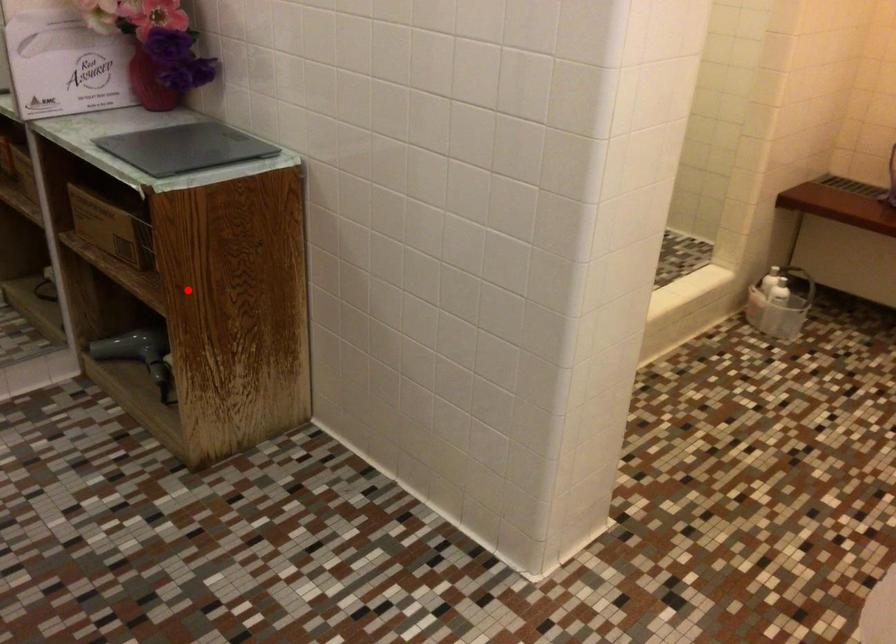
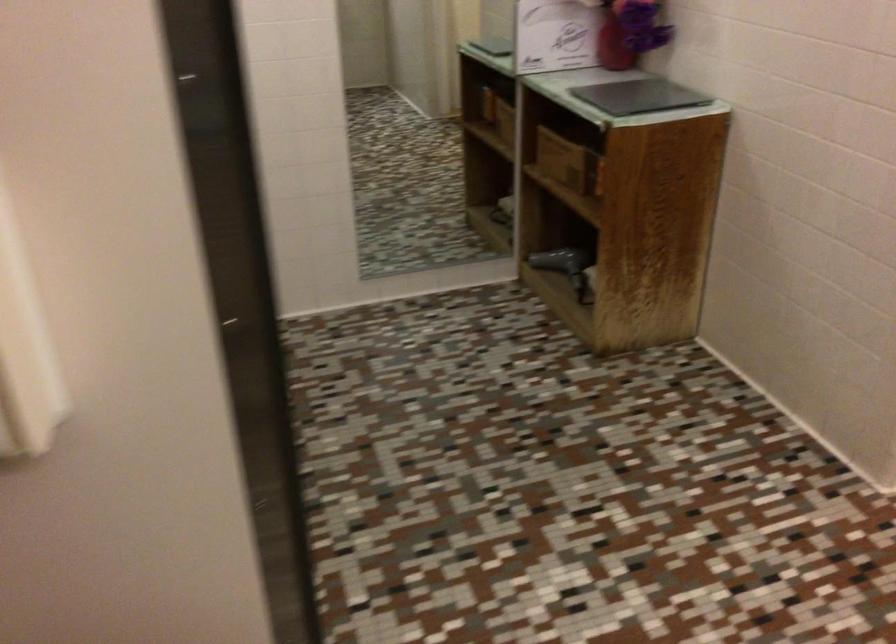
The point at the highlighted location is marked in the first image. Where is the corresponding point in the second image?

(616, 207)